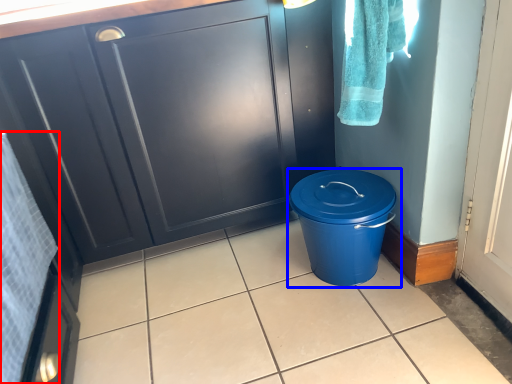
Question: Which point is closer to the camera, bath towel (highlighted by a red box) or waste container (highlighted by a blue box)?

Choices:
 (A) bath towel
 (B) waste container

Answer: (A)